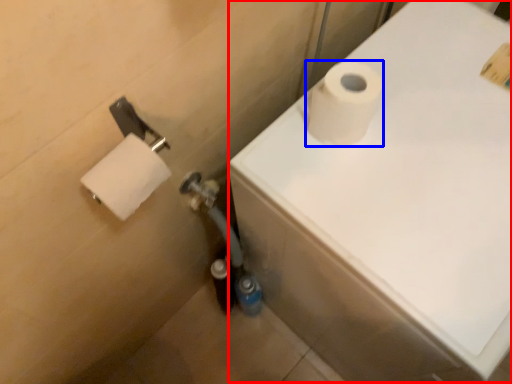
Question: Which object is closer to the camera taking this photo, bath (highlighted by a red box) or toilet paper (highlighted by a blue box)?

Choices:
 (A) bath
 (B) toilet paper

Answer: (A)